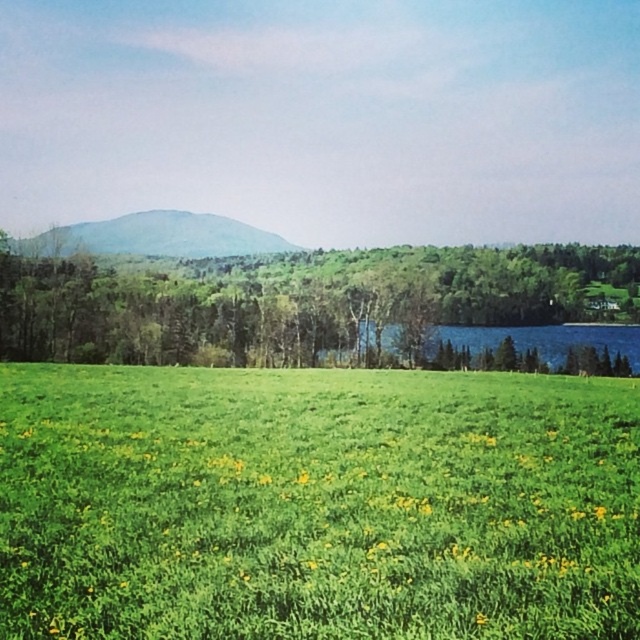
You are standing at the point labeled as point [316,504] in the image. Looking around, you see a green grassy field at center. Which direction should you walk to reach the dense line of trees in the middle ground?

To reach the dense line of trees in the middle ground from point [316,504], you should walk forward since the point is on the green grassy field at center, and the trees are in the middle ground ahead.

You are standing at the point labeled as point [316,504] in the image. What is the immediate environment around you?

The immediate environment around point [316,504] is the green grassy field at center.